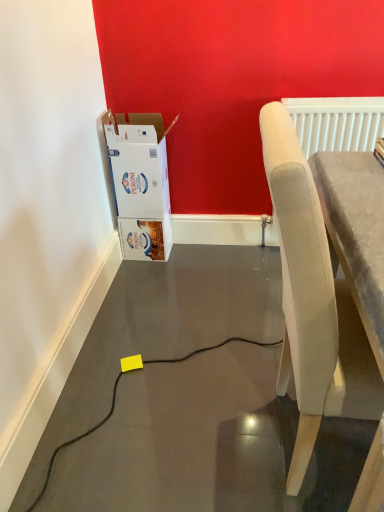
Find the location of a particular element. free spot above white textured radiator at upper right (from a real-world perspective) is located at coordinates point(337,97).